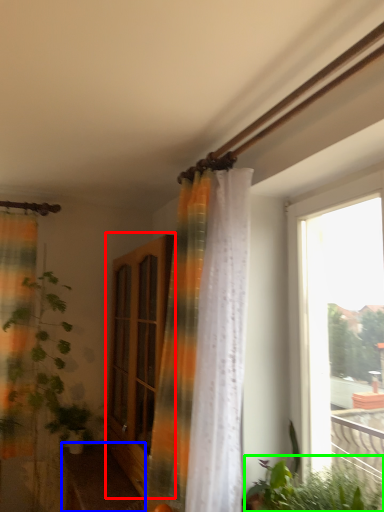
Question: Which object is positioned farthest from screen door (highlighted by a red box)? Select from furniture (highlighted by a blue box) and vegetation (highlighted by a green box).

Choices:
 (A) furniture
 (B) vegetation

Answer: (B)